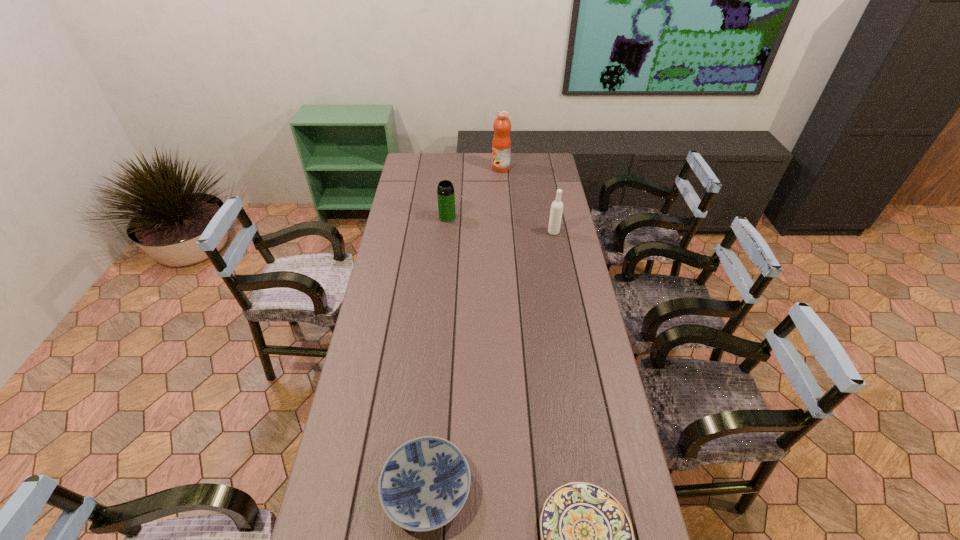
The height and width of the screenshot is (540, 960). In order to click on vacant space that satisfies the following two spatial constraints: 1. from the spout of the fourth nearest object; 2. on the right side of the vodka in this screenshot , I will do [x=446, y=232].

You are a GUI agent. You are given a task and a screenshot of the screen. Output one action in this format:
    pyautogui.click(x=<x>, y=<y>)
    Task: Click on the vacant space that satisfies the following two spatial constraints: 1. on the front label of the third nearest object; 2. on the left side of the farthest object
    This screenshot has height=540, width=960.
    Given the screenshot: What is the action you would take?
    pyautogui.click(x=505, y=232)

Locate an element on the screen. The image size is (960, 540). vacant space that satisfies the following two spatial constraints: 1. from the spout of the second farthest object; 2. on the left side of the left plate is located at coordinates (423, 490).

In order to click on vacant point that satisfies the following two spatial constraints: 1. on the front label of the third farthest object; 2. on the right side of the fruit juice in this screenshot , I will do `click(505, 232)`.

Where is `free location that satisfies the following two spatial constraints: 1. on the back side of the taller plate; 2. on the left side of the vodka`? This screenshot has width=960, height=540. free location that satisfies the following two spatial constraints: 1. on the back side of the taller plate; 2. on the left side of the vodka is located at coordinates (448, 232).